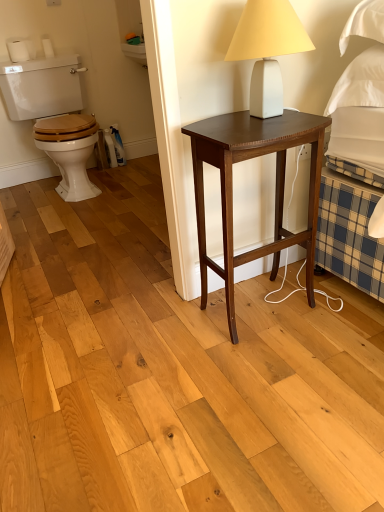
Identify the location of vacant space in front of dark wood nightstand at center. Image resolution: width=384 pixels, height=512 pixels. (281, 369).